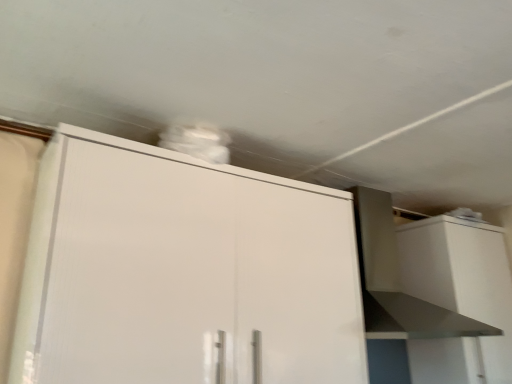
Measure the distance between white matte vent at upper right and camera.

white matte vent at upper right is 1.60 meters away from camera.

This screenshot has height=384, width=512. What do you see at coordinates (459, 297) in the screenshot? I see `white matte cabinet at right, placed as the 1th cabinetry when sorted from back to front` at bounding box center [459, 297].

Find the location of a particular element. white matte vent at upper right is located at coordinates [398, 279].

Considering the positions of point (373, 221) and point (226, 310), is point (373, 221) closer or farther from the camera than point (226, 310)?

Point (373, 221) is farther from the camera than point (226, 310).

Is white glossy cabinet at upper center, which appears as the 1th cabinetry when viewed from the front, at the back of white matte vent at upper right?

No, white glossy cabinet at upper center, which appears as the 1th cabinetry when viewed from the front, is not at the back of white matte vent at upper right.

Considering the relative positions of white matte vent at upper right and white glossy cabinet at upper center, which appears as the 1th cabinetry when viewed from the front, in the image provided, is white matte vent at upper right to the right of white glossy cabinet at upper center, which appears as the 1th cabinetry when viewed from the front, from the viewer's perspective?

Yes.

Can you tell me how much white matte vent at upper right and white glossy cabinet at upper center, arranged as the second cabinetry when viewed from the right, differ in facing direction?

0.000656 degrees.

Is white glossy cabinet at upper center, marked as the second cabinetry in a back-to-front arrangement, surrounding white matte vent at upper right?

No, white matte vent at upper right is not inside white glossy cabinet at upper center, marked as the second cabinetry in a back-to-front arrangement.

Does white glossy cabinet at upper center, marked as the second cabinetry in a back-to-front arrangement, have a lesser width compared to white matte vent at upper right?

Yes, white glossy cabinet at upper center, marked as the second cabinetry in a back-to-front arrangement, is thinner than white matte vent at upper right.

From a real-world perspective, is white glossy cabinet at upper center, arranged as the second cabinetry when viewed from the right, positioned over white matte vent at upper right based on gravity?

No, from a real-world perspective, white glossy cabinet at upper center, arranged as the second cabinetry when viewed from the right, is not on top of white matte vent at upper right.

Considering the positions of objects white glossy cabinet at upper center, positioned as the first cabinetry in left-to-right order, and white matte vent at upper right in the image provided, who is in front, white glossy cabinet at upper center, positioned as the first cabinetry in left-to-right order, or white matte vent at upper right?

white glossy cabinet at upper center, positioned as the first cabinetry in left-to-right order.

From the image's perspective, which is below, white matte cabinet at right, placed as the 1th cabinetry when sorted from back to front, or white matte vent at upper right?

white matte cabinet at right, placed as the 1th cabinetry when sorted from back to front, is shown below in the image.

Between white matte cabinet at right, which ranks as the first cabinetry in right-to-left order, and white matte vent at upper right, which one has smaller size?

Smaller between the two is white matte cabinet at right, which ranks as the first cabinetry in right-to-left order.

From a real-world perspective, between white matte cabinet at right, placed as the 1th cabinetry when sorted from back to front, and white matte vent at upper right, who is vertically higher?

white matte vent at upper right, from a real-world perspective.

Could you measure the distance between white matte cabinet at right, the second cabinetry in the left-to-right sequence, and white matte vent at upper right?

white matte cabinet at right, the second cabinetry in the left-to-right sequence, and white matte vent at upper right are 10.39 inches apart.

Would you say white matte vent at upper right is a long distance from white matte cabinet at right, the second cabinetry in the left-to-right sequence?

No, white matte vent at upper right is not far from white matte cabinet at right, the second cabinetry in the left-to-right sequence.

In terms of width, does white matte vent at upper right look wider or thinner when compared to white matte cabinet at right, which is the 2th cabinetry from front to back?

Considering their sizes, white matte vent at upper right looks broader than white matte cabinet at right, which is the 2th cabinetry from front to back.

Does point (400, 303) come farther from viewer compared to point (406, 282)?

Yes, point (400, 303) is farther from viewer.

In terms of size, does white matte vent at upper right appear bigger or smaller than white matte cabinet at right, the second cabinetry in the left-to-right sequence?

In the image, white matte vent at upper right appears to be larger than white matte cabinet at right, the second cabinetry in the left-to-right sequence.

Is white glossy cabinet at upper center, marked as the second cabinetry in a back-to-front arrangement, smaller than white matte cabinet at right, placed as the 1th cabinetry when sorted from back to front?

No.

Which point is more forward, [87,334] or [490,271]?

The point [87,334] is closer to the camera.

Does white glossy cabinet at upper center, arranged as the second cabinetry when viewed from the right, turn towards white matte cabinet at right, which ranks as the first cabinetry in right-to-left order?

No.

Is there a large distance between white glossy cabinet at upper center, marked as the second cabinetry in a back-to-front arrangement, and white matte cabinet at right, which ranks as the first cabinetry in right-to-left order?

Actually, white glossy cabinet at upper center, marked as the second cabinetry in a back-to-front arrangement, and white matte cabinet at right, which ranks as the first cabinetry in right-to-left order, are a little close together.

Is white matte cabinet at right, which ranks as the first cabinetry in right-to-left order, shorter than white glossy cabinet at upper center, which appears as the 1th cabinetry when viewed from the front?

In fact, white matte cabinet at right, which ranks as the first cabinetry in right-to-left order, may be taller than white glossy cabinet at upper center, which appears as the 1th cabinetry when viewed from the front.

Considering the sizes of objects white matte cabinet at right, which ranks as the first cabinetry in right-to-left order, and white glossy cabinet at upper center, which appears as the 1th cabinetry when viewed from the front, in the image provided, who is wider, white matte cabinet at right, which ranks as the first cabinetry in right-to-left order, or white glossy cabinet at upper center, which appears as the 1th cabinetry when viewed from the front,?

white glossy cabinet at upper center, which appears as the 1th cabinetry when viewed from the front.

Which object is further away from the camera taking this photo, white matte cabinet at right, placed as the 1th cabinetry when sorted from back to front, or white glossy cabinet at upper center, arranged as the second cabinetry when viewed from the right?

white matte cabinet at right, placed as the 1th cabinetry when sorted from back to front, is further from the camera.

This screenshot has width=512, height=384. What are the coordinates of `vent above the white glossy cabinet at upper center, arranged as the second cabinetry when viewed from the right (from a real-world perspective)` in the screenshot? It's located at point(398,279).

Find the location of a particular element. This screenshot has height=384, width=512. cabinetry on the left of white matte vent at upper right is located at coordinates (183, 272).

Estimate the real-world distances between objects in this image. Which object is closer to white glossy cabinet at upper center, arranged as the second cabinetry when viewed from the right, white matte vent at upper right or white matte cabinet at right, which is the 2th cabinetry from front to back?

Based on the image, white matte vent at upper right appears to be nearer to white glossy cabinet at upper center, arranged as the second cabinetry when viewed from the right.

Estimate the real-world distances between objects in this image. Which object is closer to white matte vent at upper right, white glossy cabinet at upper center, arranged as the second cabinetry when viewed from the right, or white matte cabinet at right, placed as the 1th cabinetry when sorted from back to front?

Based on the image, white matte cabinet at right, placed as the 1th cabinetry when sorted from back to front, appears to be nearer to white matte vent at upper right.

Considering their positions, is white matte vent at upper right positioned closer to white matte cabinet at right, placed as the 1th cabinetry when sorted from back to front, than white glossy cabinet at upper center, positioned as the first cabinetry in left-to-right order?

Based on the image, white matte vent at upper right appears to be nearer to white matte cabinet at right, placed as the 1th cabinetry when sorted from back to front.

Looking at the image, which one is located closer to white matte vent at upper right, white matte cabinet at right, which is the 2th cabinetry from front to back, or white glossy cabinet at upper center, which appears as the 1th cabinetry when viewed from the front?

Answer: The object closer to white matte vent at upper right is white matte cabinet at right, which is the 2th cabinetry from front to back.

Looking at the image, which one is located closer to white glossy cabinet at upper center, marked as the second cabinetry in a back-to-front arrangement, white matte cabinet at right, which ranks as the first cabinetry in right-to-left order, or white matte vent at upper right?

white matte vent at upper right.

Looking at the image, which one is located closer to white matte cabinet at right, the second cabinetry in the left-to-right sequence, white glossy cabinet at upper center, which appears as the 1th cabinetry when viewed from the front, or white matte vent at upper right?

white matte vent at upper right is positioned closer to the anchor white matte cabinet at right, the second cabinetry in the left-to-right sequence.

I want to click on vent between white glossy cabinet at upper center, marked as the second cabinetry in a back-to-front arrangement, and white matte cabinet at right, placed as the 1th cabinetry when sorted from back to front, so click(x=398, y=279).